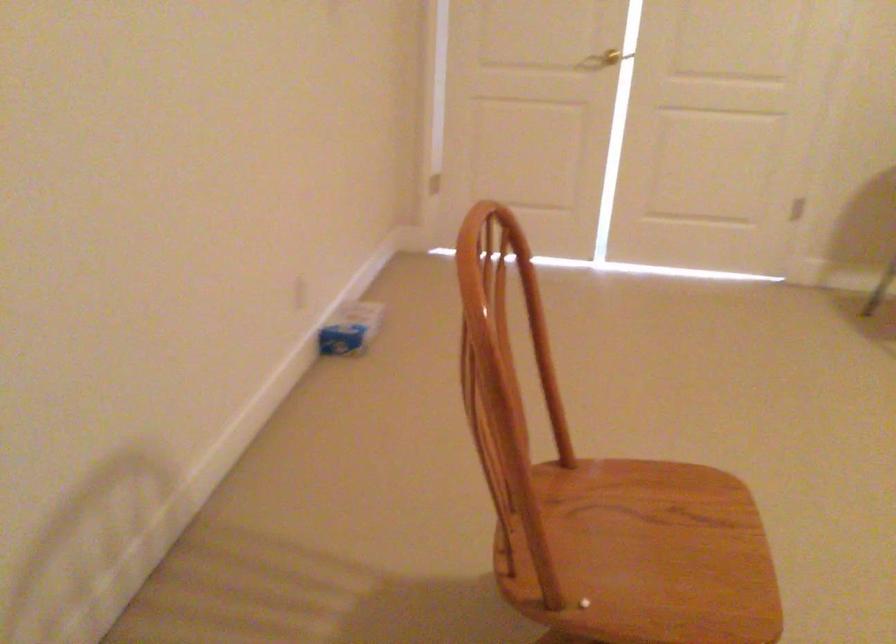
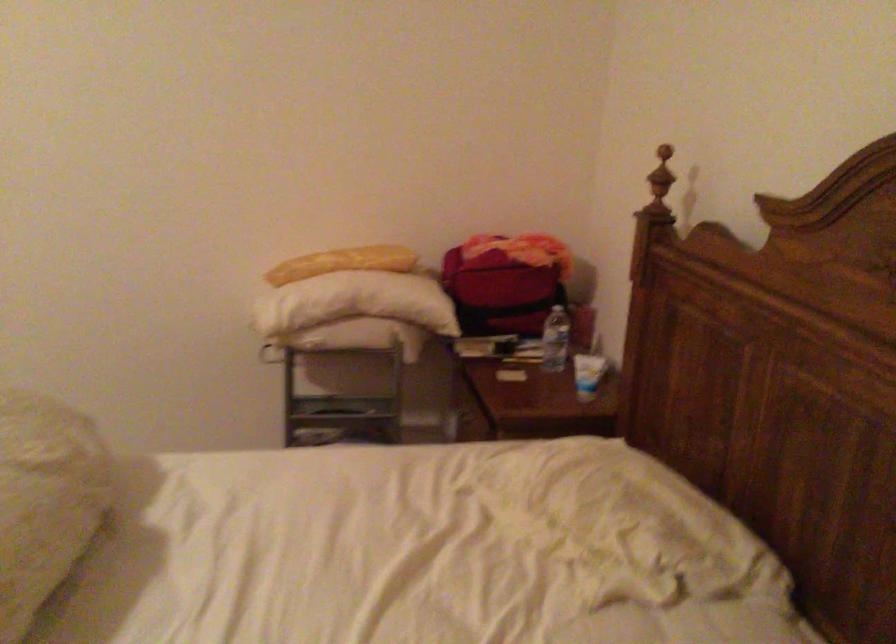
Question: In a continuous first-person perspective shot, in which direction is the camera moving?

Choices:
 (A) Left
 (B) Right
 (C) Forward
 (D) Backward

Answer: (B)